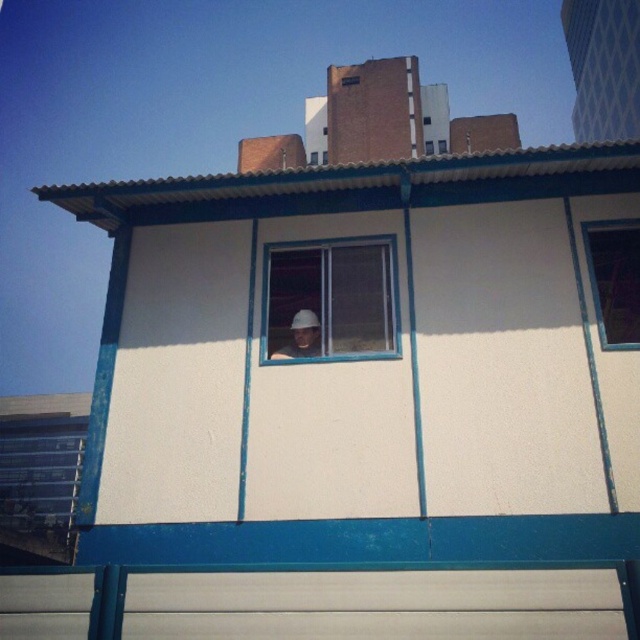
Does transparent glass window at upper right have a lesser height compared to white plastic window at center?

Indeed, transparent glass window at upper right has a lesser height compared to white plastic window at center.

Can you confirm if transparent glass window at upper right is positioned to the right of white plastic window at center?

Incorrect, transparent glass window at upper right is not on the right side of white plastic window at center.

In the scene shown: Measure the distance between point (620,298) and camera.

32.93 feet

At what (x,y) coordinates should I click in order to perform the action: click on transparent glass window at upper right. Please return your answer as a coordinate pair (x, y). Looking at the image, I should click on (614, 280).

Which is above, transparent plastic window at center or white matte helmet at center?

transparent plastic window at center is above.

Measure the distance between point (348, 259) and camera.

They are 7.28 meters apart.

This screenshot has width=640, height=640. Find the location of `transparent plastic window at center`. transparent plastic window at center is located at coordinates (330, 300).

Does point (269, 330) come behind point (445, 148)?

No, (269, 330) is in front of (445, 148).

Who is higher up, transparent plastic window at center or white plastic window at center?

white plastic window at center is above.

Measure the distance between transparent plastic window at center and camera.

A distance of 6.70 meters exists between transparent plastic window at center and camera.

Locate an element on the screen. This screenshot has width=640, height=640. transparent plastic window at center is located at coordinates (330, 300).